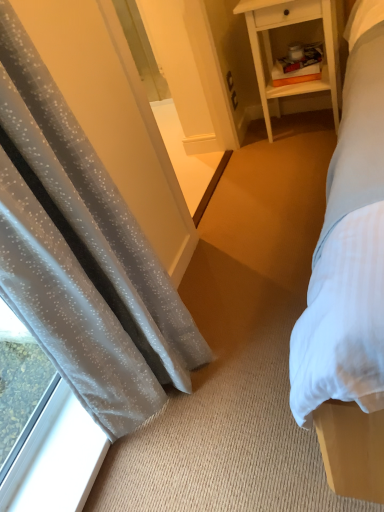
I want to click on vacant area located to the right-hand side of translucent gray curtain at left, so click(x=248, y=344).